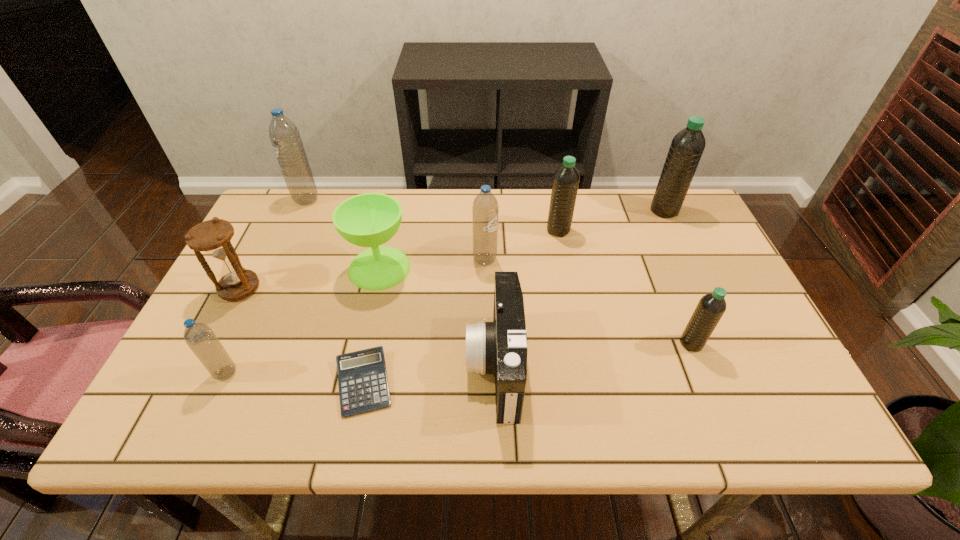
Find the location of a particular element. This screenshot has height=540, width=960. object situated at the far left corner is located at coordinates (285, 138).

You are a GUI agent. You are given a task and a screenshot of the screen. Output one action in this format:
    pyautogui.click(x=<x>, y=<y>)
    Task: Click on the object at the far right corner
    Image resolution: width=960 pixels, height=540 pixels.
    Given the screenshot: What is the action you would take?
    pyautogui.click(x=687, y=146)

The height and width of the screenshot is (540, 960). In the image, there is a desktop. Identify the location of free region at the far edge. (331, 197).

Locate an element on the screen. This screenshot has height=540, width=960. free spot at the near edge of the desktop is located at coordinates (426, 409).

Locate an element on the screen. This screenshot has width=960, height=540. free space at the left edge of the desktop is located at coordinates (269, 302).

In order to click on vacant region at the right edge in this screenshot , I will do `click(785, 394)`.

The height and width of the screenshot is (540, 960). In order to click on free point at the far left corner in this screenshot , I will do `click(304, 213)`.

Image resolution: width=960 pixels, height=540 pixels. I want to click on free spot at the far right corner of the desktop, so click(x=646, y=191).

Locate an element on the screen. vacant space at the near right corner of the desktop is located at coordinates point(771,418).

Locate an element on the screen. free area in between the second nearest water bottle and the farthest black water bottle is located at coordinates (678, 277).